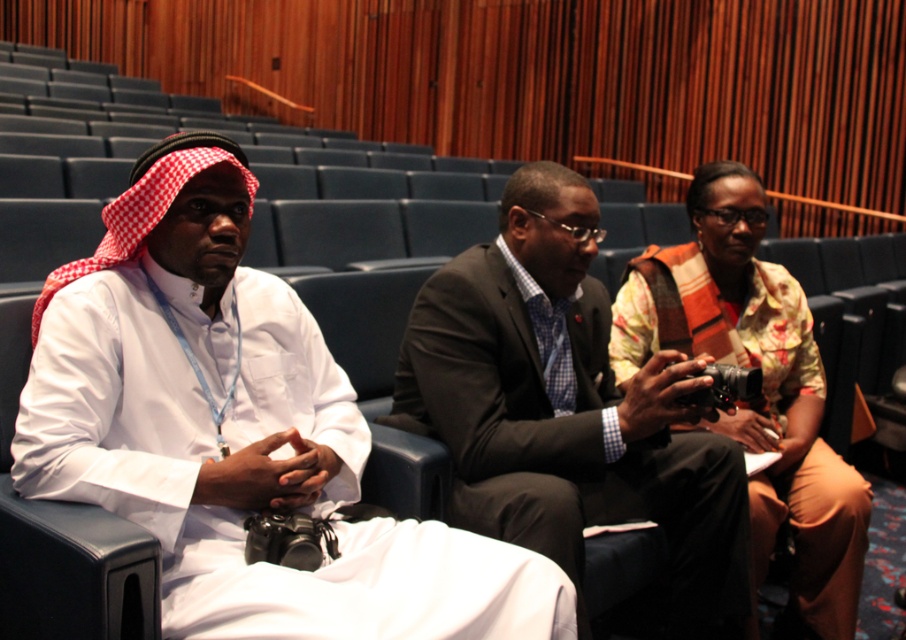
Question: Which of the following is the closest to the observer?

Choices:
 (A) white cloth at left
 (B) dark brown suit at center
 (C) floral cotton robe at center

Answer: (A)

Question: Considering the relative positions of white cloth at left and dark brown suit at center in the image provided, where is white cloth at left located with respect to dark brown suit at center?

Choices:
 (A) left
 (B) right

Answer: (A)

Question: Is dark brown suit at center below floral cotton robe at center?

Choices:
 (A) no
 (B) yes

Answer: (B)

Question: Is dark brown suit at center closer to the viewer compared to floral cotton robe at center?

Choices:
 (A) no
 (B) yes

Answer: (B)

Question: Which object is closer to the camera taking this photo?

Choices:
 (A) white cloth at left
 (B) floral cotton robe at center

Answer: (A)

Question: Among these objects, which one is nearest to the camera?

Choices:
 (A) floral cotton robe at center
 (B) white cloth at left

Answer: (B)